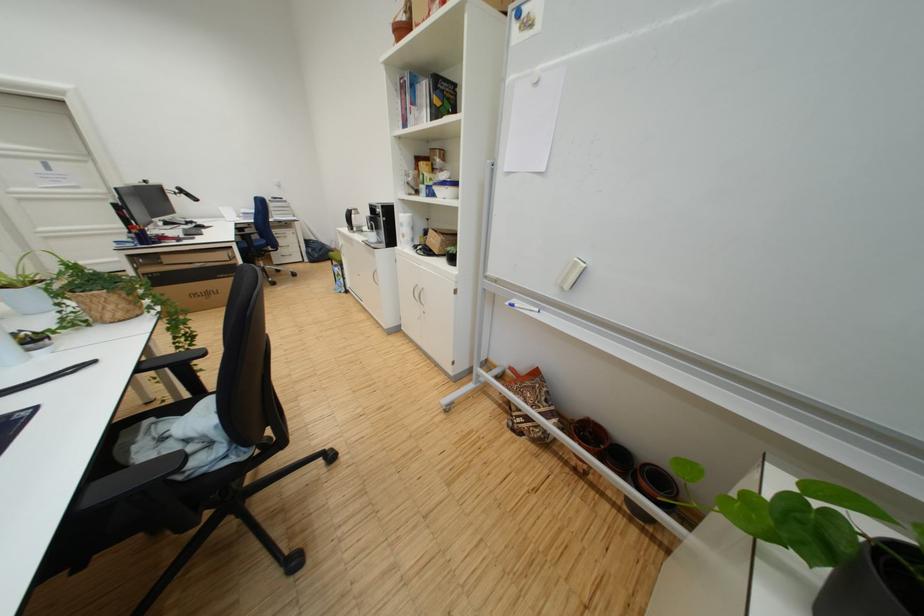
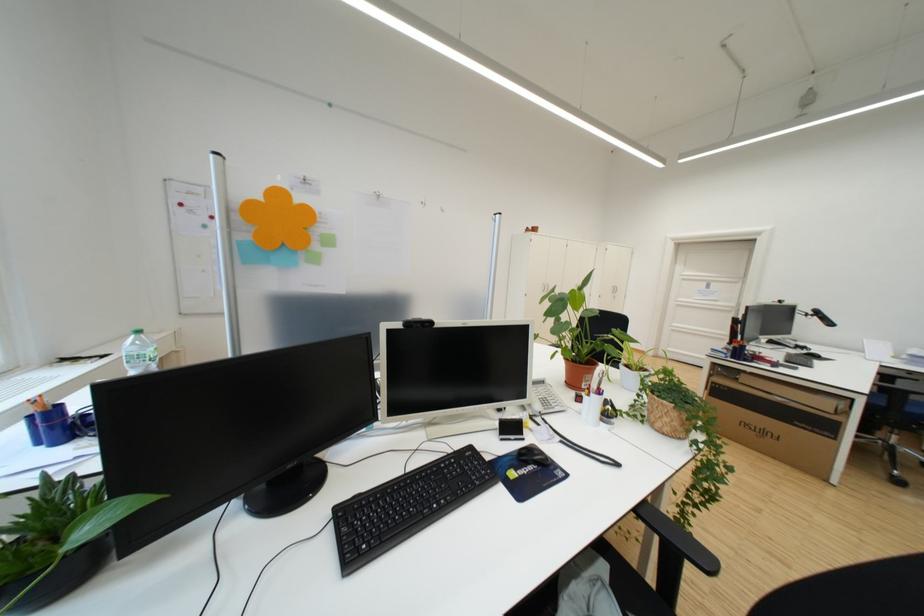
In the second image, find the point that corresponds to point (61, 169) in the first image.

(720, 288)